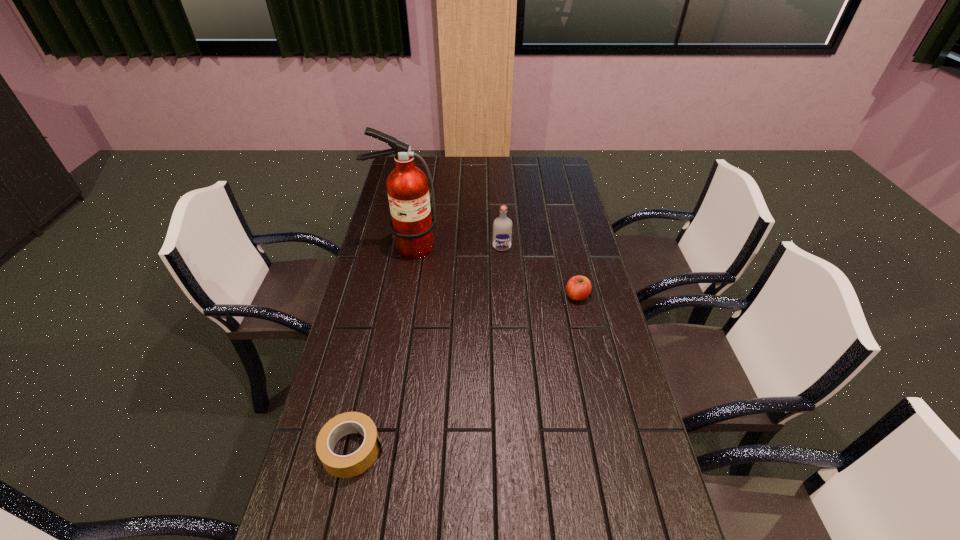
Locate an element on the screen. empty space that is in between the third tallest object and the second object from right to left is located at coordinates (540, 271).

Identify the location of vacant space in between the tallest object and the second nearest object. (492, 272).

I want to click on vacant area that lies between the vodka and the shortest object, so click(427, 348).

Locate an element on the screen. The height and width of the screenshot is (540, 960). free space between the tallest object and the rightmost object is located at coordinates (492, 272).

The image size is (960, 540). Find the location of `free spot between the rightmost object and the third object from left to right`. free spot between the rightmost object and the third object from left to right is located at coordinates (540, 271).

The image size is (960, 540). I want to click on free space between the rightmost object and the shortest object, so click(465, 373).

The height and width of the screenshot is (540, 960). Find the location of `vacant space in between the tallest object and the second shortest object`. vacant space in between the tallest object and the second shortest object is located at coordinates (492, 272).

I want to click on the closest object relative to the vodka, so click(407, 186).

This screenshot has height=540, width=960. Identify the location of object that is the nearest to the third farthest object. (502, 226).

The height and width of the screenshot is (540, 960). Find the location of `vacant space that satisfies the following two spatial constraints: 1. on the label of the third object from left to right; 2. at the edge of the shortest object`. vacant space that satisfies the following two spatial constraints: 1. on the label of the third object from left to right; 2. at the edge of the shortest object is located at coordinates (514, 449).